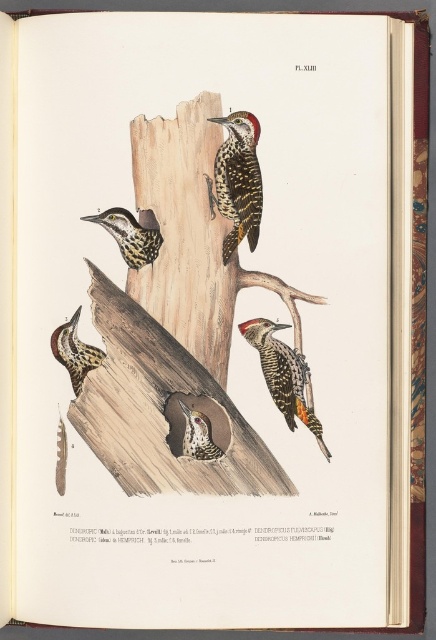
Question: Is wooden log at upper center below wooden log at center?

Choices:
 (A) no
 (B) yes

Answer: (B)

Question: Which point is closer to the camera?

Choices:
 (A) (264, 360)
 (B) (210, 99)

Answer: (B)

Question: Which point is farther from the camera taking this photo?

Choices:
 (A) (194, 433)
 (B) (224, 202)

Answer: (B)

Question: Can you confirm if wooden log at upper center is positioned to the right of speckled brown woodpecker at lower center?

Choices:
 (A) no
 (B) yes

Answer: (A)

Question: Which is nearer to the wooden log at upper center?

Choices:
 (A) matte brown woodpecker at lower left
 (B) yellow-brown speckled woodpecker at lower right
 (C) speckled brown woodpecker at lower center

Answer: (B)

Question: Can you confirm if wooden log at upper center is positioned to the right of yellow-brown speckled woodpecker at lower right?

Choices:
 (A) no
 (B) yes

Answer: (A)